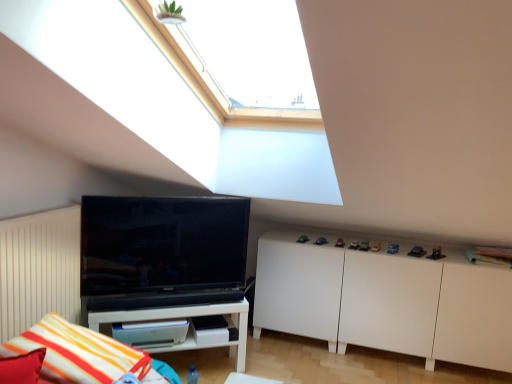
Question: Is striped fabric pillow at lower left turned away from white matte cabinet at lower right?

Choices:
 (A) yes
 (B) no

Answer: (B)

Question: Could you tell me if striped fabric pillow at lower left is facing white matte cabinet at lower right?

Choices:
 (A) yes
 (B) no

Answer: (B)

Question: Does striped fabric pillow at lower left have a lesser height compared to white matte cabinet at lower right?

Choices:
 (A) yes
 (B) no

Answer: (A)

Question: From a real-world perspective, is striped fabric pillow at lower left physically above white matte cabinet at lower right?

Choices:
 (A) yes
 (B) no

Answer: (A)

Question: Is the position of striped fabric pillow at lower left more distant than that of white matte cabinet at lower right?

Choices:
 (A) yes
 (B) no

Answer: (B)

Question: Is black glossy tv at left inside or outside of white glossy shelf at lower left?

Choices:
 (A) inside
 (B) outside

Answer: (B)

Question: Based on their sizes in the image, would you say black glossy tv at left is bigger or smaller than white glossy shelf at lower left?

Choices:
 (A) big
 (B) small

Answer: (B)

Question: In the image, is black glossy tv at left on the left side or the right side of white glossy shelf at lower left?

Choices:
 (A) right
 (B) left

Answer: (A)

Question: Looking at their shapes, would you say black glossy tv at left is wider or thinner than white glossy shelf at lower left?

Choices:
 (A) thin
 (B) wide

Answer: (A)

Question: From a real-world perspective, is striped fabric pillow at lower left physically located above or below white matte cabinet at lower right?

Choices:
 (A) above
 (B) below

Answer: (A)

Question: Is striped fabric pillow at lower left in front of or behind white matte cabinet at lower right in the image?

Choices:
 (A) behind
 (B) front

Answer: (B)

Question: Based on their sizes in the image, would you say striped fabric pillow at lower left is bigger or smaller than white matte cabinet at lower right?

Choices:
 (A) big
 (B) small

Answer: (B)

Question: Visually, is striped fabric pillow at lower left positioned to the left or to the right of white matte cabinet at lower right?

Choices:
 (A) right
 (B) left

Answer: (B)

Question: Does point (109, 355) appear closer or farther from the camera than point (131, 246)?

Choices:
 (A) farther
 (B) closer

Answer: (B)

Question: Is striped fabric pillow at lower left situated inside black glossy tv at left or outside?

Choices:
 (A) outside
 (B) inside

Answer: (A)